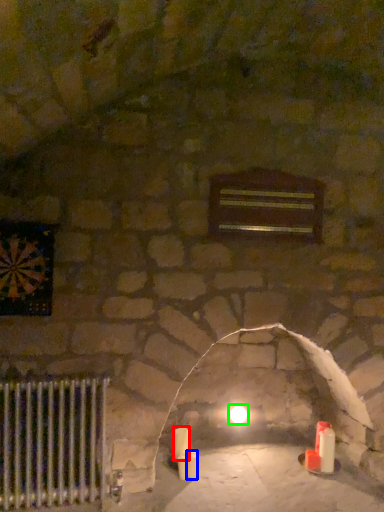
Question: Which object is the farthest from candle (highlighted by a red box)? Choose among these: candle (highlighted by a blue box) or glow (highlighted by a green box).

Choices:
 (A) candle
 (B) glow

Answer: (B)